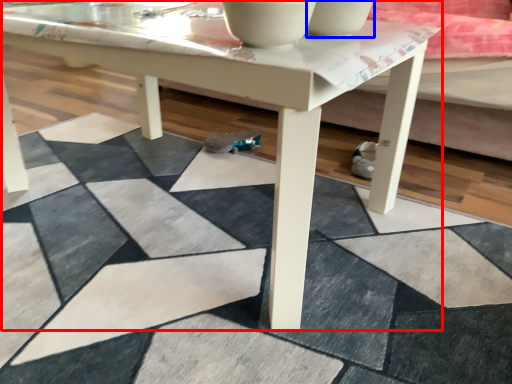
Question: Which object is closer to the camera taking this photo, coffee table (highlighted by a red box) or bowl (highlighted by a blue box)?

Choices:
 (A) coffee table
 (B) bowl

Answer: (A)